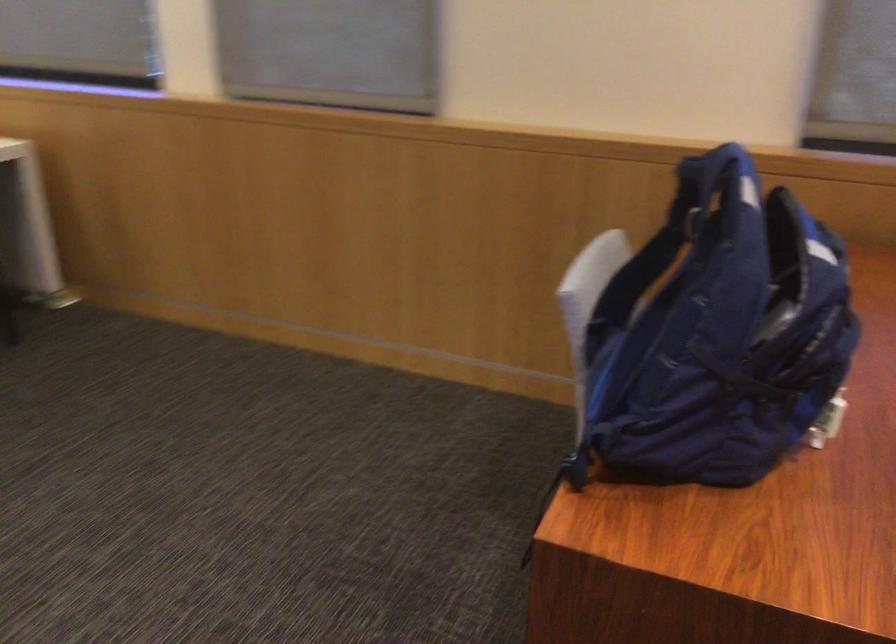
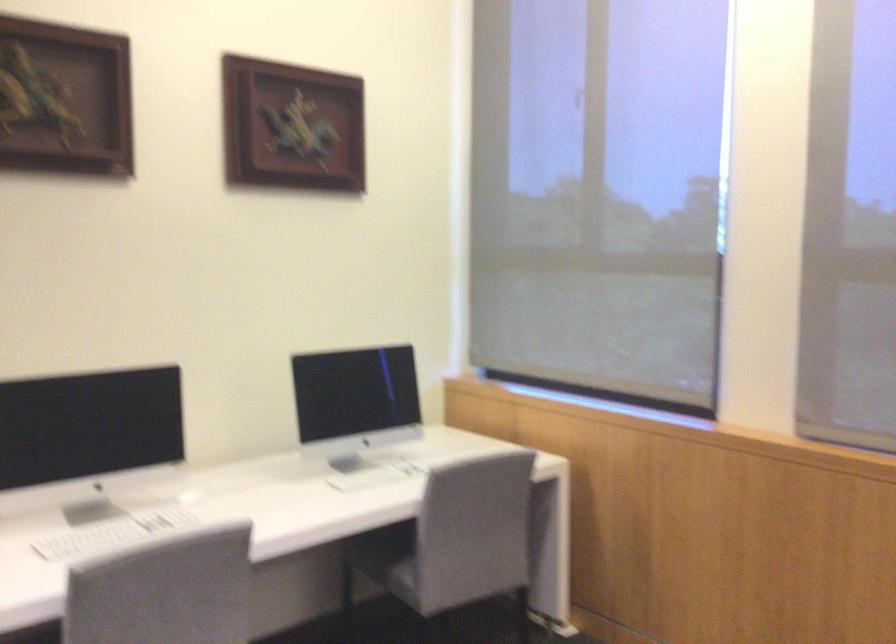
The first image is from the beginning of the video and the second image is from the end. How did the camera likely rotate when shooting the video?

The rotation direction of the camera is left-up.